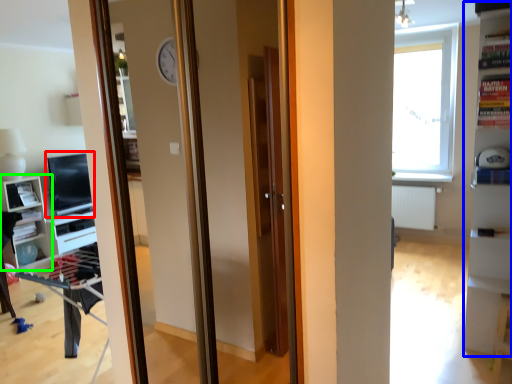
Question: Which object is the farthest from computer monitor (highlighted by a red box)? Choose among these: bookshelf (highlighted by a blue box) or shelf (highlighted by a green box).

Choices:
 (A) bookshelf
 (B) shelf

Answer: (A)